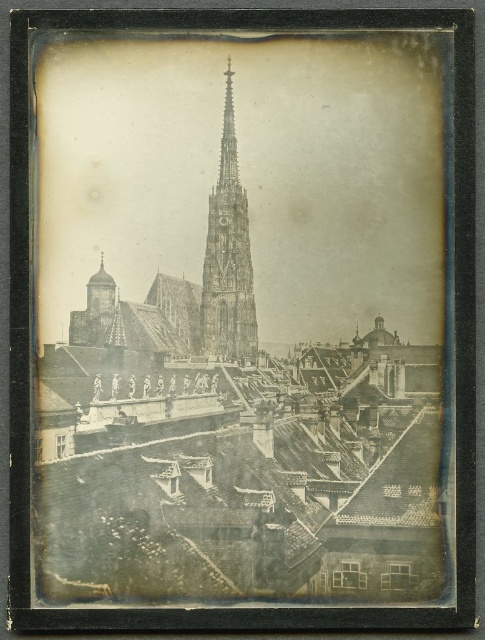
Does point (254, 84) come farther from viewer compared to point (211, 192)?

Yes, it is behind point (211, 192).

Which is below, dark gray stone church at center or stone spire at center?

Positioned lower is dark gray stone church at center.

I want to click on dark gray stone church at center, so pyautogui.click(x=240, y=326).

This screenshot has width=485, height=640. Find the location of `dark gray stone church at center`. dark gray stone church at center is located at coordinates (240, 326).